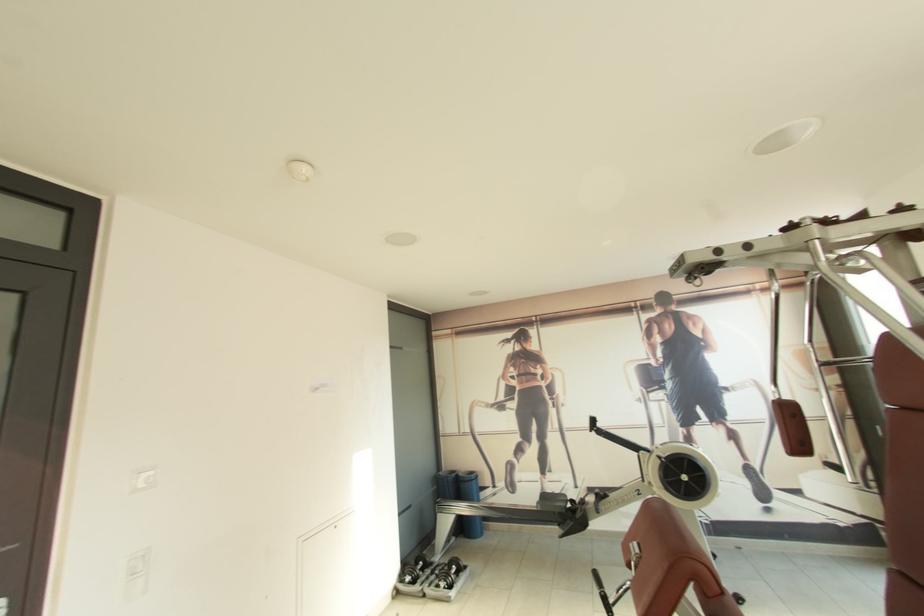
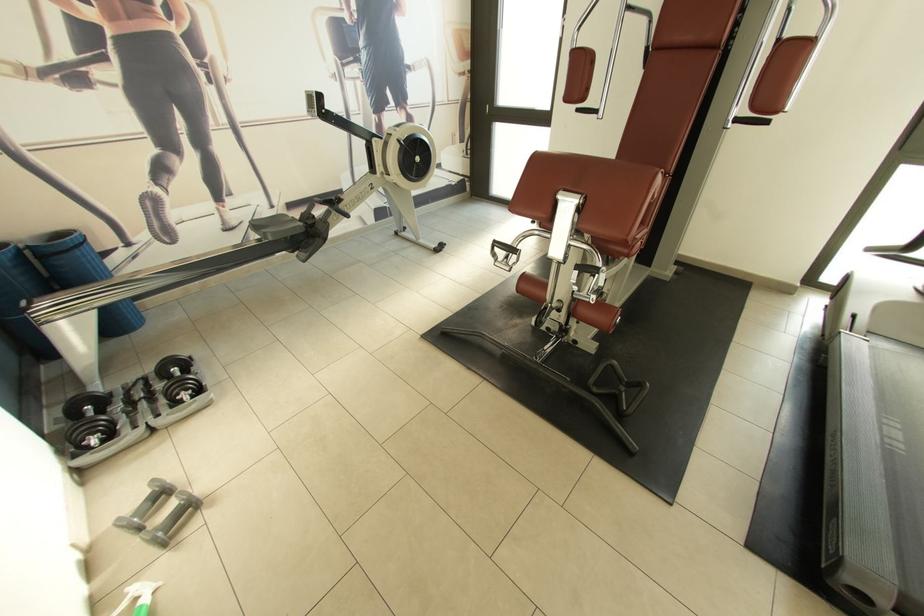
The point at (882, 427) is marked in the first image. Where is the corresponding point in the second image?

(492, 107)